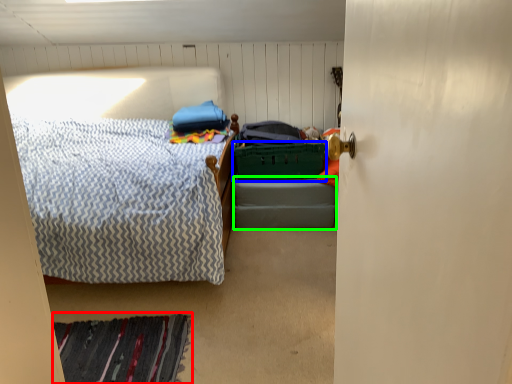
Question: Considering the real-world distances, which object is farthest from mat (highlighted by a red box)? laundry basket (highlighted by a blue box) or bed frame (highlighted by a green box)?

Choices:
 (A) laundry basket
 (B) bed frame

Answer: (A)